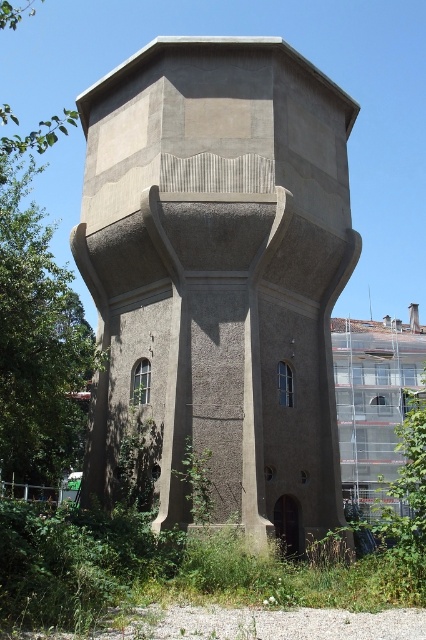
You are standing in front of the water tower and want to take a photo of the green leafy weed at lower center without the concrete textured tower at center blocking the view. Which direction should you move to achieve this?

Move to the left side of the green leafy weed at lower center since the concrete textured tower at center is to the right of it.

You are standing at the point labeled point (x=219, y=275). What object are you standing on?

You are standing on the concrete textured tower at center, which is represented by point (x=219, y=275).

You are a gardener who wants to trim the green leafy weed at lower center without damaging the concrete textured tower at center. Can you safely trim the weed since the tower is taller than the weed?

The concrete textured tower at center is taller than the green leafy weed at lower center, so yes, you can safely trim the green leafy weed at lower center without damaging the tower since it is shorter and positioned lower.